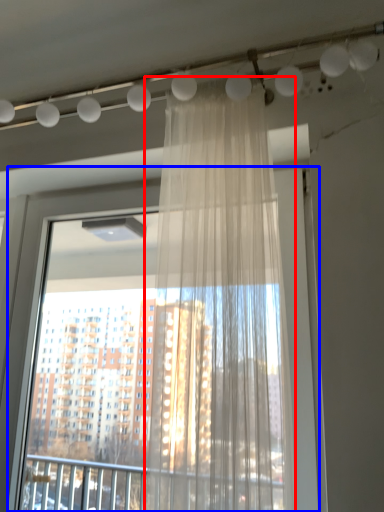
Question: Which point is further to the camera, curtain (highlighted by a red box) or window (highlighted by a blue box)?

Choices:
 (A) curtain
 (B) window

Answer: (B)